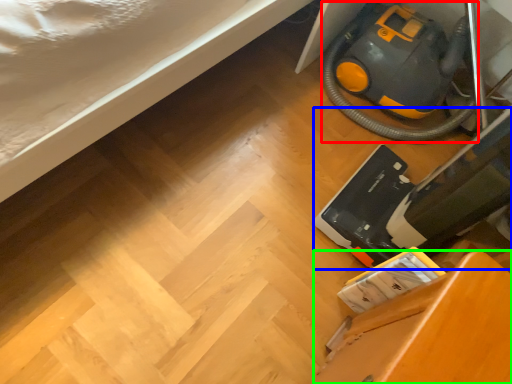
Question: Which object is positioned closest to equipment (highlighted by a red box)? Select from equipment (highlighted by a blue box) and furniture (highlighted by a green box).

Choices:
 (A) equipment
 (B) furniture

Answer: (A)